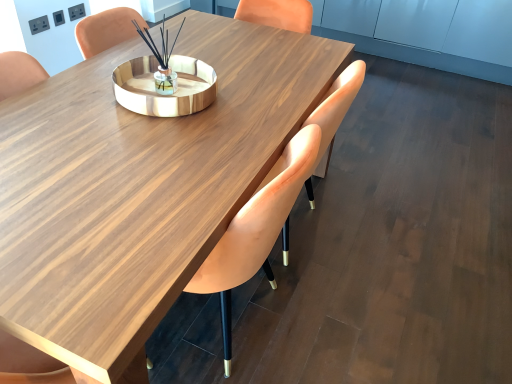
Measure the distance between wooden table at center and camera.

28.30 inches.

At what (x,y) coordinates should I click in order to perform the action: click on wooden table at center. Please return your answer as a coordinate pair (x, y). The width and height of the screenshot is (512, 384). Looking at the image, I should click on (138, 187).

Image resolution: width=512 pixels, height=384 pixels. What do you see at coordinates (138, 187) in the screenshot? I see `wooden table at center` at bounding box center [138, 187].

This screenshot has height=384, width=512. I want to click on wooden table at center, so tap(138, 187).